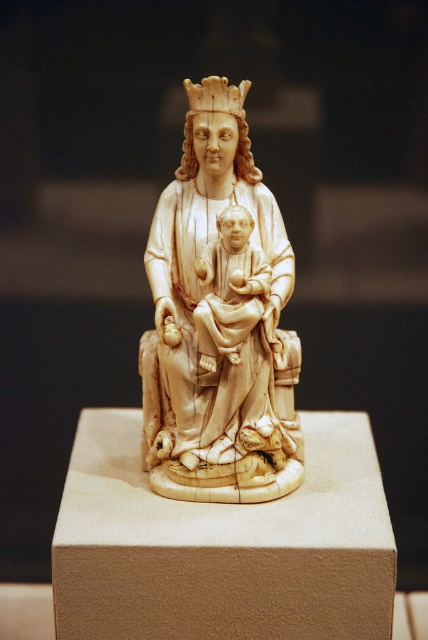
Can you confirm if ivory statue at center is positioned below ivory/carved wood baby at center?

Yes.

Who is taller, ivory statue at center or ivory/carved wood baby at center?

ivory statue at center

Is point (172, 225) positioned in front of point (205, 353)?

No, it is not.

Locate an element on the screen. Image resolution: width=428 pixels, height=640 pixels. ivory statue at center is located at coordinates (219, 328).

Which is more to the left, ivory/carved wood baby at center or ivory textured crown at upper center?

ivory textured crown at upper center

Is point (217, 300) farther from viewer compared to point (217, 96)?

No, (217, 300) is in front of (217, 96).

Locate an element on the screen. Image resolution: width=428 pixels, height=640 pixels. ivory/carved wood baby at center is located at coordinates (229, 289).

Between ivory statue at center and ivory textured crown at upper center, which one has more height?

ivory statue at center

Does ivory statue at center have a greater height compared to ivory textured crown at upper center?

Yes.

Is point (225, 442) behind point (237, 109)?

No, (225, 442) is in front of (237, 109).

Find the location of a particular element. The height and width of the screenshot is (640, 428). ivory statue at center is located at coordinates (219, 328).